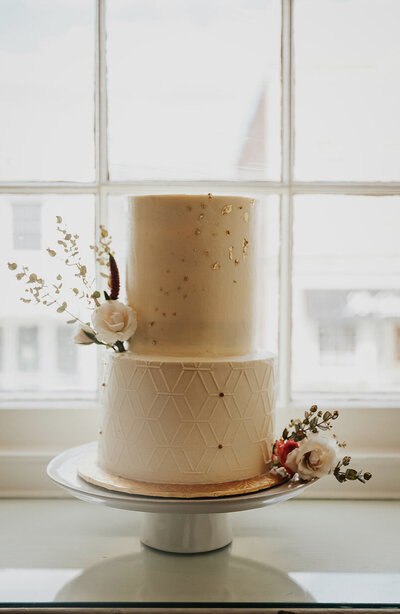
Identify the location of windowsill. This screenshot has width=400, height=614. (378, 451), (14, 454).